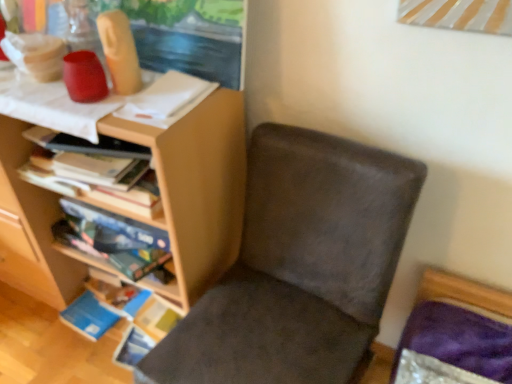
Question: Is suede-like brown chair at center shorter than wooden bookshelf at left, which ranks as the 2th shelf in top-to-bottom order?

Choices:
 (A) no
 (B) yes

Answer: (A)

Question: Is suede-like brown chair at center further to the viewer compared to wooden bookshelf at left, which ranks as the 2th shelf in top-to-bottom order?

Choices:
 (A) yes
 (B) no

Answer: (B)

Question: Is suede-like brown chair at center taller than wooden bookshelf at left, which ranks as the 2th shelf in top-to-bottom order?

Choices:
 (A) yes
 (B) no

Answer: (A)

Question: Would you consider suede-like brown chair at center to be distant from wooden bookshelf at left, which ranks as the 2th shelf in top-to-bottom order?

Choices:
 (A) yes
 (B) no

Answer: (B)

Question: From a real-world perspective, is suede-like brown chair at center located higher than wooden bookshelf at left, which ranks as the 2th shelf in top-to-bottom order?

Choices:
 (A) yes
 (B) no

Answer: (B)

Question: From a real-world perspective, is matte wood shelf at upper left, which is counted as the second shelf, starting from the bottom, physically located above or below wooden bookshelf at left, which ranks as the 2th shelf in top-to-bottom order?

Choices:
 (A) below
 (B) above

Answer: (B)

Question: Is matte wood shelf at upper left, which is counted as the second shelf, starting from the bottom, situated inside wooden bookshelf at left, the first shelf from the bottom, or outside?

Choices:
 (A) outside
 (B) inside

Answer: (A)

Question: Considering the positions of matte wood shelf at upper left, which is counted as the second shelf, starting from the bottom, and wooden bookshelf at left, which ranks as the 2th shelf in top-to-bottom order, in the image, is matte wood shelf at upper left, which is counted as the second shelf, starting from the bottom, wider or thinner than wooden bookshelf at left, which ranks as the 2th shelf in top-to-bottom order,?

Choices:
 (A) wide
 (B) thin

Answer: (A)

Question: Considering their positions, is matte wood shelf at upper left, which is counted as the second shelf, starting from the bottom, located in front of or behind wooden bookshelf at left, the first shelf from the bottom?

Choices:
 (A) front
 (B) behind

Answer: (A)

Question: Considering the positions of suede-like brown chair at center and matte wood shelf at upper left, which ranks as the first shelf in top-to-bottom order, in the image, is suede-like brown chair at center taller or shorter than matte wood shelf at upper left, which ranks as the first shelf in top-to-bottom order,?

Choices:
 (A) short
 (B) tall

Answer: (A)

Question: From a real-world perspective, is suede-like brown chair at center physically located above or below matte wood shelf at upper left, which ranks as the first shelf in top-to-bottom order?

Choices:
 (A) below
 (B) above

Answer: (A)

Question: Is point (247, 311) closer or farther from the camera than point (16, 228)?

Choices:
 (A) closer
 (B) farther

Answer: (A)

Question: Looking at their shapes, would you say suede-like brown chair at center is wider or thinner than matte wood shelf at upper left, which is counted as the second shelf, starting from the bottom?

Choices:
 (A) wide
 (B) thin

Answer: (A)

Question: Considering the positions of matte wood shelf at upper left, which is counted as the second shelf, starting from the bottom, and suede-like brown chair at center in the image, is matte wood shelf at upper left, which is counted as the second shelf, starting from the bottom, wider or thinner than suede-like brown chair at center?

Choices:
 (A) thin
 (B) wide

Answer: (A)

Question: In terms of size, does matte wood shelf at upper left, which ranks as the first shelf in top-to-bottom order, appear bigger or smaller than suede-like brown chair at center?

Choices:
 (A) big
 (B) small

Answer: (A)